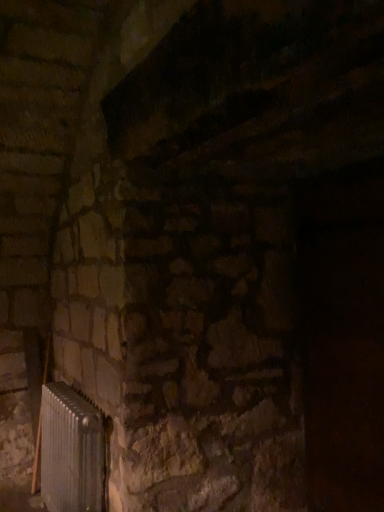
Question: Should I look upward or downward to see silver metallic radiator at lower left?

Choices:
 (A) down
 (B) up

Answer: (A)